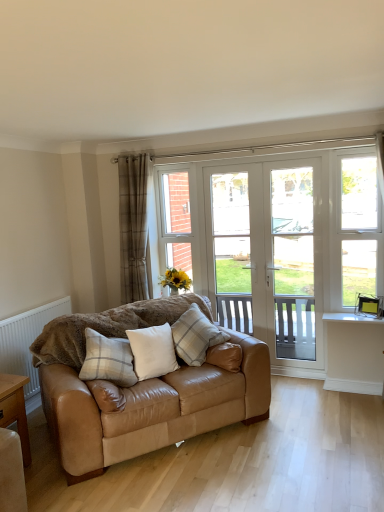
Question: Considering their positions, is plaid fabric curtain at left located in front of or behind white glass screen door at center, positioned as the first screen door in left-to-right order?

Choices:
 (A) front
 (B) behind

Answer: (B)

Question: In terms of height, does plaid fabric curtain at left look taller or shorter compared to white glass screen door at center, positioned as the first screen door in left-to-right order?

Choices:
 (A) short
 (B) tall

Answer: (A)

Question: Which of these objects is positioned farthest from the plaid fabric pillow at center, which is the 1th pillow in left-to-right order?

Choices:
 (A) tan leather couch at center
 (B) white leather pillow at center, positioned as the second pillow in right-to-left order
 (C) yellow matte vase at center
 (D) white glass screen door at center, acting as the second screen door starting from the right
 (E) white plastic window at center

Answer: (D)

Question: Considering the real-world distances, which object is closest to the white plastic window at right?

Choices:
 (A) white leather pillow at center, positioned as the second pillow in right-to-left order
 (B) plaid fabric curtain at left
 (C) white textured radiator at lower left
 (D) white plastic window at center
 (E) white glass screen door at center, positioned as the first screen door in left-to-right order

Answer: (E)